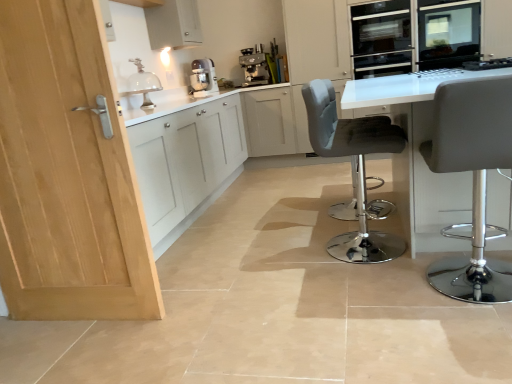
Question: Does satin silver oven at upper right lie behind matte gray stool at right, which is the 1th chair in front-to-back order?

Choices:
 (A) yes
 (B) no

Answer: (A)

Question: Does satin silver oven at upper right appear on the right side of matte gray stool at right, which is the 1th chair in front-to-back order?

Choices:
 (A) yes
 (B) no

Answer: (A)

Question: Does satin silver oven at upper right appear on the left side of matte gray stool at right, the 2th chair when ordered from back to front?

Choices:
 (A) no
 (B) yes

Answer: (A)

Question: Is satin silver oven at upper right taller than matte gray stool at right, which is the 1th chair in front-to-back order?

Choices:
 (A) yes
 (B) no

Answer: (B)

Question: From a real-world perspective, is satin silver oven at upper right physically above matte gray stool at right, which is the 1th chair in front-to-back order?

Choices:
 (A) no
 (B) yes

Answer: (B)

Question: Is white matte cabinet at upper left inside or outside of matte gray stool at right, the 2th chair when ordered from back to front?

Choices:
 (A) inside
 (B) outside

Answer: (B)

Question: Does point (184, 13) appear closer or farther from the camera than point (473, 94)?

Choices:
 (A) closer
 (B) farther

Answer: (B)

Question: From the image's perspective, is white matte cabinet at upper left located above or below matte gray stool at right, which is the 1th chair in front-to-back order?

Choices:
 (A) above
 (B) below

Answer: (A)

Question: From a real-world perspective, relative to matte gray stool at right, which is the 1th chair in front-to-back order, is white matte cabinet at upper left vertically above or below?

Choices:
 (A) below
 (B) above

Answer: (B)

Question: Looking at their shapes, would you say satin silver oven at upper right is wider or thinner than white matte cabinet at upper left?

Choices:
 (A) wide
 (B) thin

Answer: (A)

Question: Relative to white matte cabinet at upper left, is satin silver oven at upper right in front or behind?

Choices:
 (A) behind
 (B) front

Answer: (A)

Question: Do you think satin silver oven at upper right is within white matte cabinet at upper left, or outside of it?

Choices:
 (A) outside
 (B) inside

Answer: (A)

Question: From the image's perspective, is satin silver oven at upper right positioned above or below white matte cabinet at upper left?

Choices:
 (A) above
 (B) below

Answer: (B)

Question: Is white glossy table at center taller or shorter than clear glass dome at upper center?

Choices:
 (A) short
 (B) tall

Answer: (B)

Question: From the image's perspective, is white glossy table at center above or below clear glass dome at upper center?

Choices:
 (A) above
 (B) below

Answer: (B)